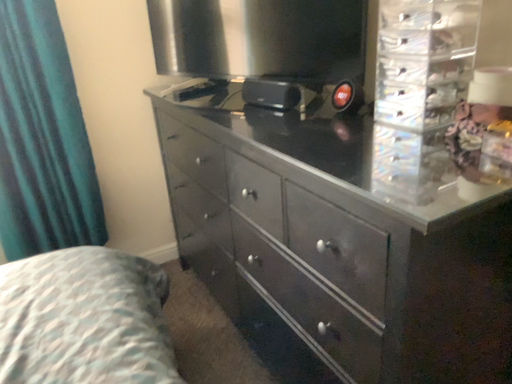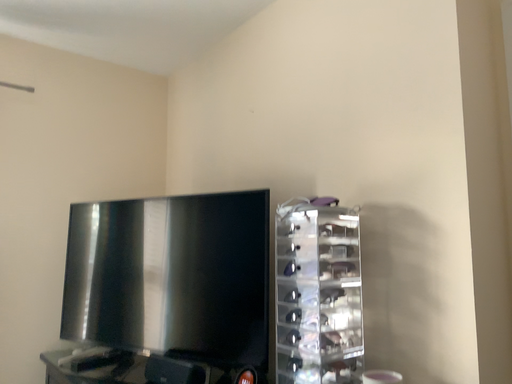
Question: Which way did the camera rotate in the video?

Choices:
 (A) rotated downward
 (B) rotated upward

Answer: (B)